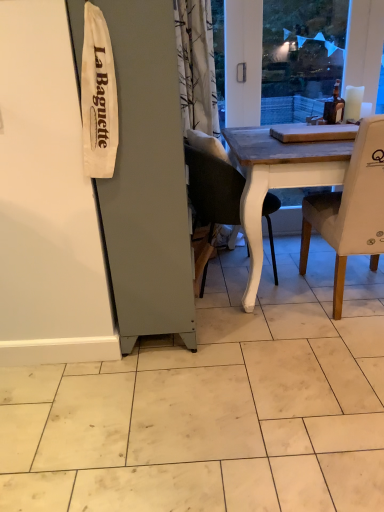
Locate an element on the screen. This screenshot has width=384, height=512. matte black chair at center, which is the second chair from right to left is located at coordinates (213, 189).

What do you see at coordinates (213, 189) in the screenshot? This screenshot has width=384, height=512. I see `matte black chair at center, arranged as the 1th chair when viewed from the left` at bounding box center [213, 189].

Describe the element at coordinates (351, 209) in the screenshot. This screenshot has height=512, width=384. I see `white fabric chair at right, which ranks as the 2th chair in left-to-right order` at that location.

The image size is (384, 512). I want to click on white fabric chair at right, which ranks as the 2th chair in left-to-right order, so click(351, 209).

Find the location of a particular element. The height and width of the screenshot is (512, 384). matte black chair at center, which is the second chair from right to left is located at coordinates (213, 189).

Which object is positioned more to the left, white fabric chair at right, which ranks as the 2th chair in left-to-right order, or matte black chair at center, arranged as the 1th chair when viewed from the left?

matte black chair at center, arranged as the 1th chair when viewed from the left.

Is white fabric chair at right, acting as the first chair starting from the right, in front of or behind matte black chair at center, which is the second chair from right to left, in the image?

Visually, white fabric chair at right, acting as the first chair starting from the right, is located in front of matte black chair at center, which is the second chair from right to left.

Which is less distant, [376,250] or [203,168]?

Point [376,250] is positioned closer to the camera compared to point [203,168].

From the image's perspective, would you say white fabric chair at right, acting as the first chair starting from the right, is shown under matte black chair at center, arranged as the 1th chair when viewed from the left?

Yes.

From a real-world perspective, is white fabric chair at right, acting as the first chair starting from the right, physically located above or below matte black chair at center, which is the second chair from right to left?

Clearly, from a real-world perspective, white fabric chair at right, acting as the first chair starting from the right, is above matte black chair at center, which is the second chair from right to left.

In terms of width, does white fabric chair at right, which ranks as the 2th chair in left-to-right order, look wider or thinner when compared to matte black chair at center, which is the second chair from right to left?

In the image, white fabric chair at right, which ranks as the 2th chair in left-to-right order, appears to be wider than matte black chair at center, which is the second chair from right to left.

Can you confirm if white fabric chair at right, which ranks as the 2th chair in left-to-right order, is shorter than matte black chair at center, arranged as the 1th chair when viewed from the left?

No.

Can you confirm if white fabric chair at right, acting as the first chair starting from the right, is smaller than matte black chair at center, which is the second chair from right to left?

Actually, white fabric chair at right, acting as the first chair starting from the right, might be larger than matte black chair at center, which is the second chair from right to left.

Does white fabric chair at right, acting as the first chair starting from the right, contain matte black chair at center, which is the second chair from right to left?

No, matte black chair at center, which is the second chair from right to left, is not inside white fabric chair at right, acting as the first chair starting from the right.

Is white fabric chair at right, which ranks as the 2th chair in left-to-right order, touching matte black chair at center, which is the second chair from right to left?

white fabric chair at right, which ranks as the 2th chair in left-to-right order, and matte black chair at center, which is the second chair from right to left, are clearly separated.

Could you tell me if white fabric chair at right, which ranks as the 2th chair in left-to-right order, is facing matte black chair at center, which is the second chair from right to left?

No, white fabric chair at right, which ranks as the 2th chair in left-to-right order, is not aimed at matte black chair at center, which is the second chair from right to left.

What's the angular difference between white fabric chair at right, acting as the first chair starting from the right, and matte black chair at center, which is the second chair from right to left,'s facing directions?

They differ by 90 degrees in their facing directions.

Where is `chair above the white fabric chair at right, which ranks as the 2th chair in left-to-right order (from the image's perspective)`? This screenshot has height=512, width=384. chair above the white fabric chair at right, which ranks as the 2th chair in left-to-right order (from the image's perspective) is located at coordinates tap(213, 189).

Considering the positions of objects matte black chair at center, which is the second chair from right to left, and white fabric chair at right, acting as the first chair starting from the right, in the image provided, who is more to the right, matte black chair at center, which is the second chair from right to left, or white fabric chair at right, acting as the first chair starting from the right,?

From the viewer's perspective, white fabric chair at right, acting as the first chair starting from the right, appears more on the right side.

Considering their positions, is matte black chair at center, arranged as the 1th chair when viewed from the left, located in front of or behind white fabric chair at right, which ranks as the 2th chair in left-to-right order?

Visually, matte black chair at center, arranged as the 1th chair when viewed from the left, is located behind white fabric chair at right, which ranks as the 2th chair in left-to-right order.

Considering the points (186, 142) and (320, 211), which point is behind, point (186, 142) or point (320, 211)?

The point (320, 211) is farther.

From the image's perspective, which object appears higher, matte black chair at center, which is the second chair from right to left, or white fabric chair at right, acting as the first chair starting from the right?

matte black chair at center, which is the second chair from right to left, appears higher in the image.

From a real-world perspective, is matte black chair at center, which is the second chair from right to left, on white fabric chair at right, which ranks as the 2th chair in left-to-right order?

Actually, matte black chair at center, which is the second chair from right to left, is physically below white fabric chair at right, which ranks as the 2th chair in left-to-right order, in the real world.

Which of these two, matte black chair at center, which is the second chair from right to left, or white fabric chair at right, acting as the first chair starting from the right, is wider?

white fabric chair at right, acting as the first chair starting from the right.

From their relative heights in the image, would you say matte black chair at center, which is the second chair from right to left, is taller or shorter than white fabric chair at right, which ranks as the 2th chair in left-to-right order?

In the image, matte black chair at center, which is the second chair from right to left, appears to be shorter than white fabric chair at right, which ranks as the 2th chair in left-to-right order.

Who is bigger, matte black chair at center, arranged as the 1th chair when viewed from the left, or white fabric chair at right, which ranks as the 2th chair in left-to-right order?

white fabric chair at right, which ranks as the 2th chair in left-to-right order, is bigger.

Which is correct: matte black chair at center, arranged as the 1th chair when viewed from the left, is inside white fabric chair at right, which ranks as the 2th chair in left-to-right order, or outside of it?

matte black chair at center, arranged as the 1th chair when viewed from the left, is not enclosed by white fabric chair at right, which ranks as the 2th chair in left-to-right order.

In the scene shown: Are matte black chair at center, arranged as the 1th chair when viewed from the left, and white fabric chair at right, which ranks as the 2th chair in left-to-right order, far apart?

No, matte black chair at center, arranged as the 1th chair when viewed from the left, is not far from white fabric chair at right, which ranks as the 2th chair in left-to-right order.

Is matte black chair at center, arranged as the 1th chair when viewed from the left, positioned with its back to white fabric chair at right, which ranks as the 2th chair in left-to-right order?

That's not correct — matte black chair at center, arranged as the 1th chair when viewed from the left, is not looking away from white fabric chair at right, which ranks as the 2th chair in left-to-right order.

This screenshot has height=512, width=384. What are the coordinates of `chair above the matte black chair at center, which is the second chair from right to left (from a real-world perspective)` in the screenshot? It's located at (351, 209).

At what (x,y) coordinates should I click in order to perform the action: click on chair on the left of white fabric chair at right, acting as the first chair starting from the right. Please return your answer as a coordinate pair (x, y). This screenshot has height=512, width=384. Looking at the image, I should click on (213, 189).

This screenshot has width=384, height=512. What are the coordinates of `chair above the white fabric chair at right, which ranks as the 2th chair in left-to-right order (from the image's perspective)` in the screenshot? It's located at (213, 189).